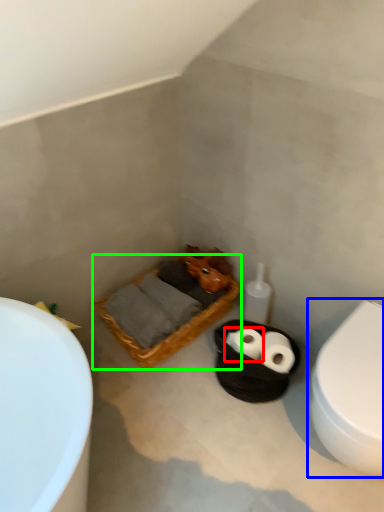
Question: Which object is the farthest from toilet paper (highlighted by a red box)? Choose among these: toilet (highlighted by a blue box) or basket (highlighted by a green box).

Choices:
 (A) toilet
 (B) basket

Answer: (A)